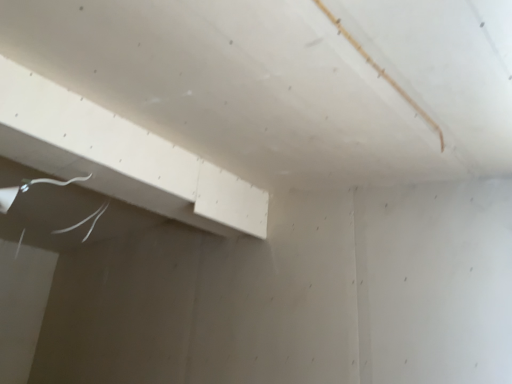
This screenshot has width=512, height=384. In order to click on white matte exhaust hood at upper left in this screenshot , I will do `click(120, 157)`.

What do you see at coordinates (120, 157) in the screenshot? I see `white matte exhaust hood at upper left` at bounding box center [120, 157].

Where is `white matte exhaust hood at upper left`? The image size is (512, 384). white matte exhaust hood at upper left is located at coordinates (120, 157).